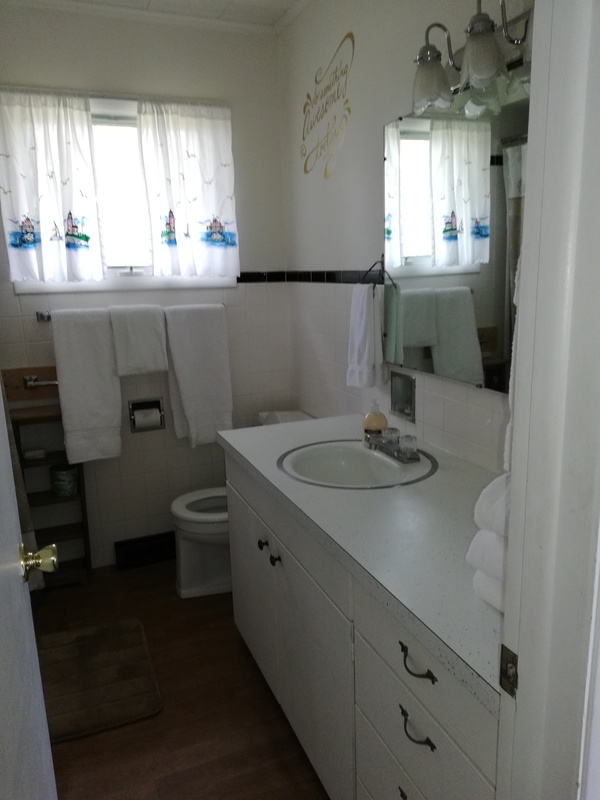
Locate an element on the screen. drawer handles for grasping is located at coordinates (411, 670), (412, 736), (273, 562), (262, 545).